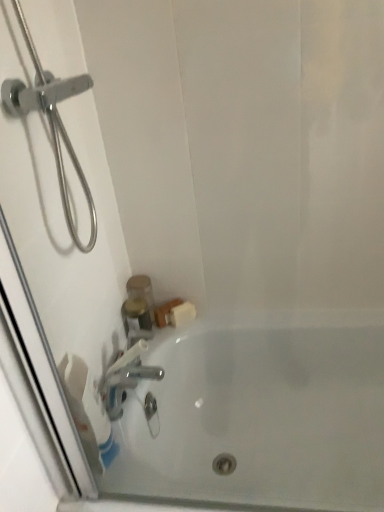
Question: Does white matte toilet paper at lower left come in front of translucent plastic container at upper left?

Choices:
 (A) yes
 (B) no

Answer: (A)

Question: Does white matte toilet paper at lower left have a greater width compared to translucent plastic container at upper left?

Choices:
 (A) no
 (B) yes

Answer: (A)

Question: Is white matte toilet paper at lower left in contact with translucent plastic container at upper left?

Choices:
 (A) no
 (B) yes

Answer: (A)

Question: Is white matte toilet paper at lower left surrounding translucent plastic container at upper left?

Choices:
 (A) no
 (B) yes

Answer: (A)

Question: Would you say white matte toilet paper at lower left is a long distance from translucent plastic container at upper left?

Choices:
 (A) no
 (B) yes

Answer: (A)

Question: Relative to white matte toilet paper at lower left, is silver metallic faucet at lower left in front or behind?

Choices:
 (A) behind
 (B) front

Answer: (A)

Question: Would you say silver metallic faucet at lower left is to the left or to the right of white matte toilet paper at lower left in the picture?

Choices:
 (A) right
 (B) left

Answer: (A)

Question: From a real-world perspective, is silver metallic faucet at lower left positioned above or below white matte toilet paper at lower left?

Choices:
 (A) below
 (B) above

Answer: (A)

Question: Is silver metallic faucet at lower left inside the boundaries of white matte toilet paper at lower left, or outside?

Choices:
 (A) outside
 (B) inside

Answer: (A)

Question: Looking at their shapes, would you say silver metallic faucet at lower left is wider or thinner than translucent plastic container at upper left?

Choices:
 (A) wide
 (B) thin

Answer: (A)

Question: Is point (140, 373) positioned closer to the camera than point (153, 320)?

Choices:
 (A) closer
 (B) farther

Answer: (B)

Question: From a real-world perspective, is silver metallic faucet at lower left positioned above or below translucent plastic container at upper left?

Choices:
 (A) above
 (B) below

Answer: (A)

Question: Is silver metallic faucet at lower left taller or shorter than translucent plastic container at upper left?

Choices:
 (A) tall
 (B) short

Answer: (B)

Question: Does point (132, 302) appear closer or farther from the camera than point (188, 332)?

Choices:
 (A) closer
 (B) farther

Answer: (A)

Question: In the image, is silver metallic faucet at lower left positioned in front of or behind white glossy bathtub at lower center?

Choices:
 (A) behind
 (B) front

Answer: (A)